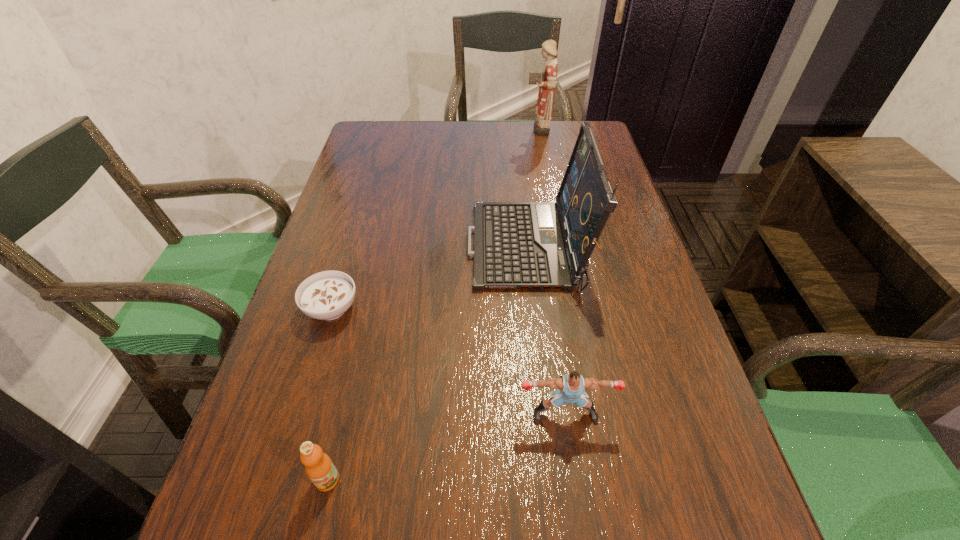
Find the location of a particular element. This screenshot has width=960, height=540. object that is at the far right corner is located at coordinates (546, 80).

Identify the location of free spot at the far edge of the desktop. (454, 125).

I want to click on vacant space at the left edge of the desktop, so click(355, 188).

The image size is (960, 540). I want to click on vacant space at the right edge of the desktop, so click(623, 230).

You are a GUI agent. You are given a task and a screenshot of the screen. Output one action in this format:
    pyautogui.click(x=<x>, y=<y>)
    Task: Click on the free space at the far left corner of the desktop
    The width and height of the screenshot is (960, 540).
    Given the screenshot: What is the action you would take?
    pyautogui.click(x=411, y=126)

Where is `unoccupied position between the soup bowl and the puncher`? Image resolution: width=960 pixels, height=540 pixels. unoccupied position between the soup bowl and the puncher is located at coordinates (448, 361).

This screenshot has width=960, height=540. What are the coordinates of `vacant space that is in between the farthest object and the shortest object` in the screenshot? It's located at (435, 218).

You are a GUI agent. You are given a task and a screenshot of the screen. Output one action in this format:
    pyautogui.click(x=<x>, y=<y>)
    Task: Click on the blank region between the laptop computer and the nearest object
    Image resolution: width=960 pixels, height=540 pixels.
    Given the screenshot: What is the action you would take?
    pyautogui.click(x=427, y=364)

Find the location of a particular element. The width and height of the screenshot is (960, 540). unoccupied area between the puncher and the shortest object is located at coordinates (448, 361).

In order to click on free spot between the soup bowl and the second nearest object in this screenshot , I will do coord(448,361).